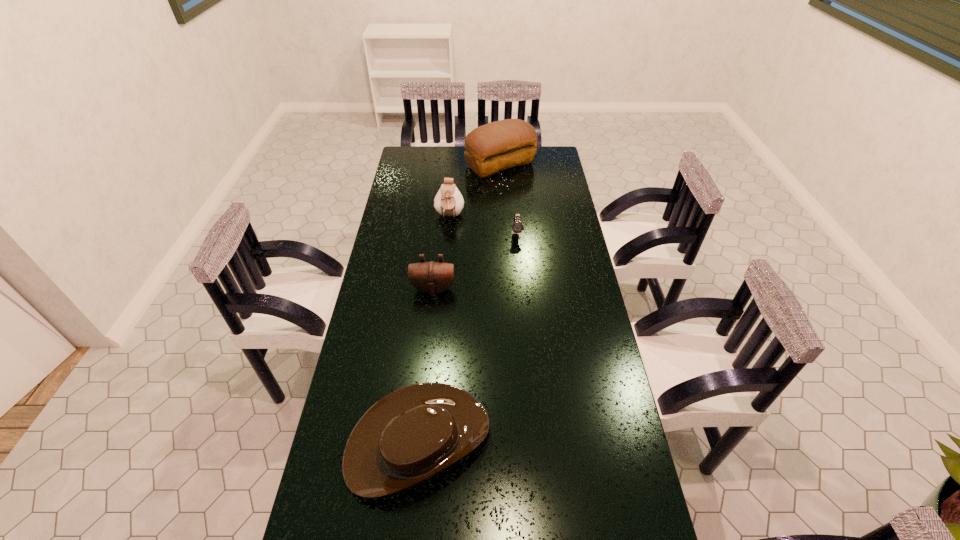
Locate an element on the screen. bread is located at coordinates (496, 146).

I want to click on the farthest object, so click(496, 146).

You are a GUI agent. You are given a task and a screenshot of the screen. Output one action in this format:
    pyautogui.click(x=<x>, y=<y>)
    Task: Click on the second farthest object
    
    Given the screenshot: What is the action you would take?
    pyautogui.click(x=448, y=202)

Find the location of a particular element. This screenshot has width=960, height=540. the farther pouch is located at coordinates (448, 202).

In order to click on the nearer pouch in this screenshot , I will do `click(431, 277)`.

Image resolution: width=960 pixels, height=540 pixels. What are the coordinates of `the shorter pouch` in the screenshot? It's located at (431, 277).

I want to click on the third nearest object, so click(517, 227).

At what (x,y) coordinates should I click in order to perform the action: click on cowboy hat. Please return your answer as a coordinate pair (x, y). The width and height of the screenshot is (960, 540). Looking at the image, I should click on (412, 434).

Locate an element on the screen. vacant space located on the front of the farthest object is located at coordinates (503, 217).

This screenshot has width=960, height=540. In order to click on free space located 0.290m on the front-facing side of the second tallest object in this screenshot , I will do `click(444, 275)`.